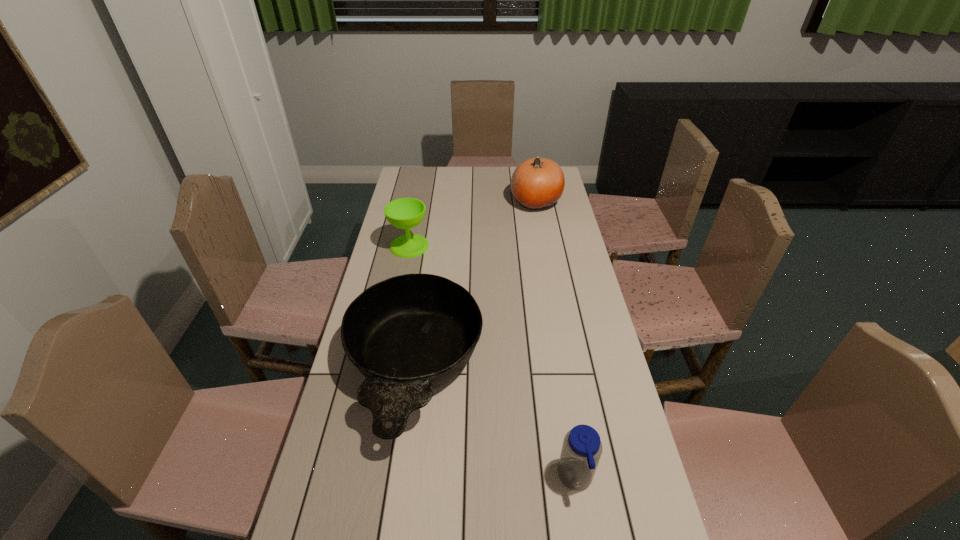
Identify the location of the tallest object. The height and width of the screenshot is (540, 960). (537, 183).

Locate an element on the screen. pumpkin is located at coordinates (537, 183).

Locate an element on the screen. The image size is (960, 540). wineglass is located at coordinates (405, 213).

The width and height of the screenshot is (960, 540). In order to click on water bottle in this screenshot , I will do `click(582, 448)`.

The image size is (960, 540). I want to click on frying pan, so click(409, 334).

At what (x,y) coordinates should I click in order to perform the action: click on free region located 0.400m on the left of the tallest object. Please return your answer as a coordinate pair (x, y). Looking at the image, I should click on (422, 201).

This screenshot has width=960, height=540. What are the coordinates of `free region located on the right of the wineglass` in the screenshot? It's located at (471, 246).

The image size is (960, 540). In order to click on free space located with a carrying loop on the side of the water bottle in this screenshot , I will do `click(475, 478)`.

The height and width of the screenshot is (540, 960). I want to click on blank area located with a carrying loop on the side of the water bottle, so click(512, 478).

This screenshot has width=960, height=540. Identify the location of free region located with a carrying loop on the side of the water bottle. (475, 478).